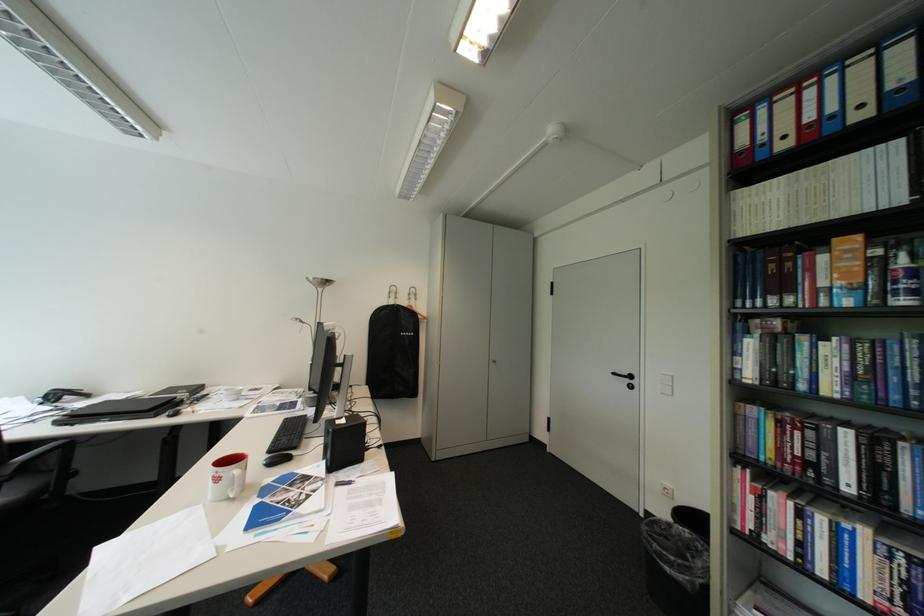
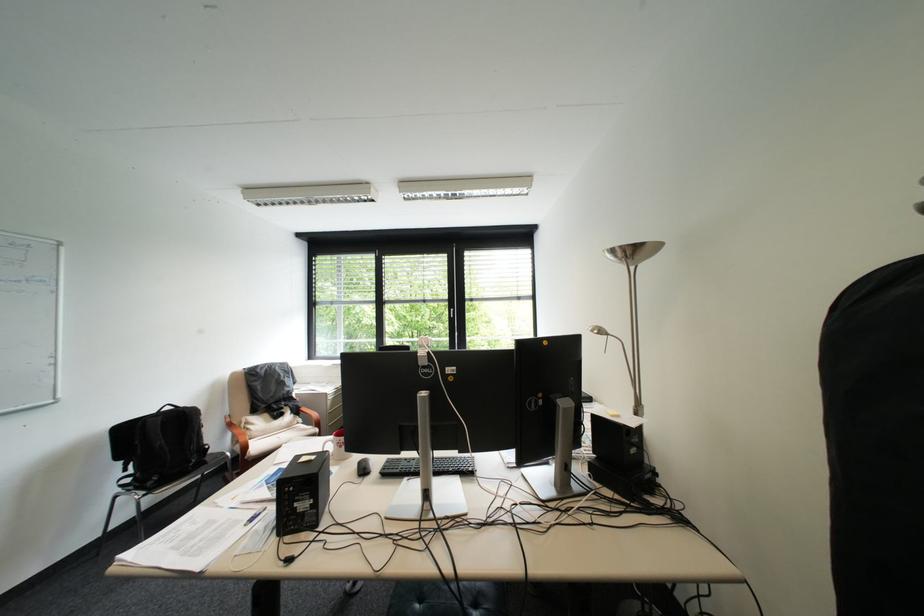
In the second image, find the point that corresponds to point 326,278 in the first image.

(625, 252)